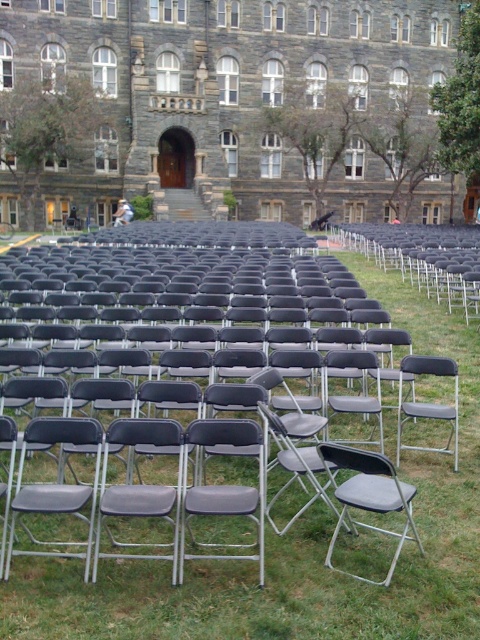
Is matte black chair at center thinner than gray matte folding chair at center?

No.

Can you confirm if matte black chair at center is smaller than gray matte folding chair at center?

Actually, matte black chair at center might be larger than gray matte folding chair at center.

Who is more distant from viewer, [423,262] or [197,513]?

Positioned behind is point [423,262].

Locate an element on the screen. matte black chair at center is located at coordinates click(422, 259).

Can you confirm if green grass at center is positioned to the left of matte gray folding chair at center?

Indeed, green grass at center is positioned on the left side of matte gray folding chair at center.

Does green grass at center have a greater height compared to matte gray folding chair at center?

Indeed, green grass at center has a greater height compared to matte gray folding chair at center.

Between point (465, 625) and point (432, 372), which one is positioned in front?

Point (465, 625) is in front.

Image resolution: width=480 pixels, height=640 pixels. Find the location of `green grass at center`. green grass at center is located at coordinates (298, 547).

In the scene shown: Who is more distant from viewer, (367, 611) or (247, 509)?

The point (247, 509) is more distant.

Is point (228, 608) positioned after point (263, 477)?

No.

Image resolution: width=480 pixels, height=640 pixels. I want to click on green grass at center, so click(x=298, y=547).